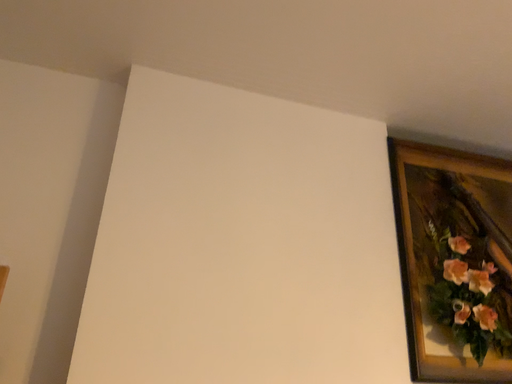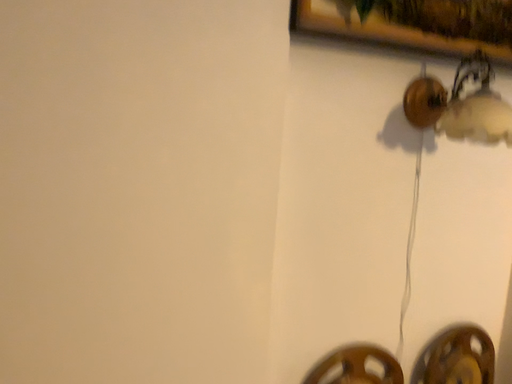
Question: Which way did the camera rotate in the video?

Choices:
 (A) rotated left
 (B) rotated right

Answer: (B)